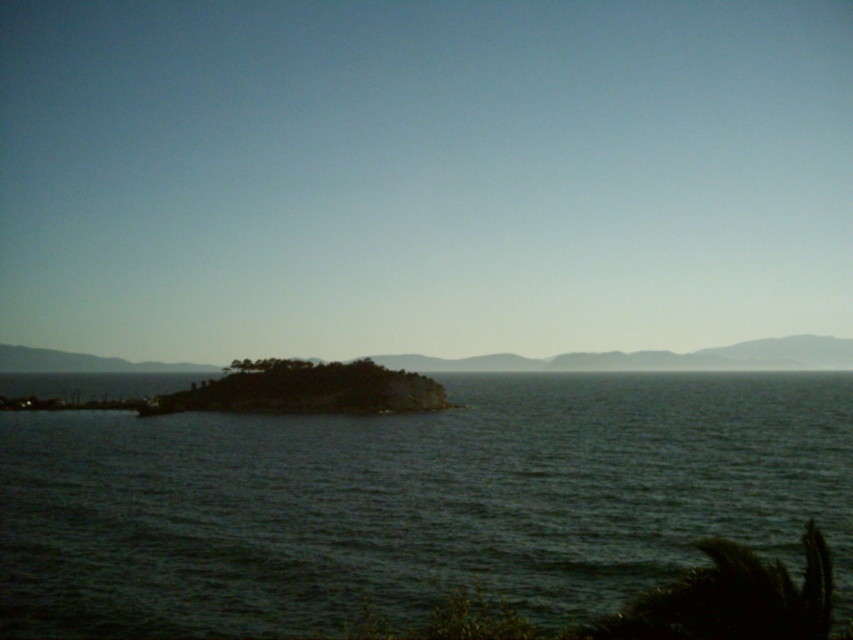
The image size is (853, 640). Describe the element at coordinates (654, 358) in the screenshot. I see `smooth gray horizon at center` at that location.

Is point (459, 369) positioned after point (345, 387)?

Yes, it is behind point (345, 387).

Who is more forward, (602, 364) or (265, 408)?

Point (265, 408) is in front.

At what (x,y) coordinates should I click in order to perform the action: click on smooth gray horizon at center. Please return your answer as a coordinate pair (x, y). Looking at the image, I should click on (654, 358).

Can you confirm if dark water at center is positioned to the left of smooth gray horizon at center?

Yes, dark water at center is to the left of smooth gray horizon at center.

Can you confirm if dark water at center is taller than smooth gray horizon at center?

No.

The image size is (853, 640). What are the coordinates of `dark water at center` in the screenshot? It's located at (413, 502).

Where is `dark water at center`? The height and width of the screenshot is (640, 853). dark water at center is located at coordinates (413, 502).

Looking at this image, can you confirm if dark water at center is positioned below green mossy rock at center?

Yes, dark water at center is below green mossy rock at center.

Which is more to the left, dark water at center or green mossy rock at center?

dark water at center

Does point (222, 561) lie in front of point (363, 365)?

Yes, it is in front of point (363, 365).

Where is `dark water at center`? The width and height of the screenshot is (853, 640). dark water at center is located at coordinates (413, 502).